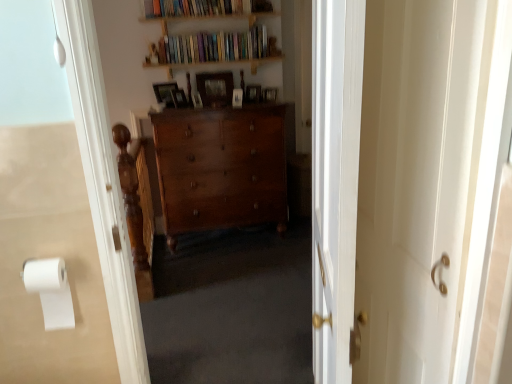
The image size is (512, 384). Identify the location of wooden picture frame at center, which ranks as the 2th picture frame in right-to-left order. (253, 93).

Where is `wooden picture frame at center, arranged as the 4th picture frame when viewed from the right`? The height and width of the screenshot is (384, 512). wooden picture frame at center, arranged as the 4th picture frame when viewed from the right is located at coordinates (215, 88).

This screenshot has height=384, width=512. I want to click on wooden picture frame at center, the sixth picture frame in the right-to-left sequence, so click(x=165, y=93).

Find the location of `wooden picture frame at center, acting as the fifth picture frame starting from the right`. wooden picture frame at center, acting as the fifth picture frame starting from the right is located at coordinates (179, 98).

Find the location of a particular element. Image resolution: width=512 pixels, height=384 pixels. hardcover books at upper center, the second book when ordered from top to bottom is located at coordinates (215, 46).

What do you see at coordinates (425, 182) in the screenshot? I see `white glossy screen door at center` at bounding box center [425, 182].

What are the coordinates of `wooden picture frame at center, which is the 3th picture frame in right-to-left order` in the screenshot? It's located at (237, 98).

From the image's perspective, who appears lower, wooden picture frame at center, placed as the fifth picture frame when sorted from left to right, or wooden picture frame at center, which is the sixth picture frame in left-to-right order?

wooden picture frame at center, which is the sixth picture frame in left-to-right order, from the image's perspective.

Is wooden picture frame at center, which ranks as the 2th picture frame in right-to-left order, shorter than wooden picture frame at center, which is the sixth picture frame in left-to-right order?

No.

Considering the sizes of wooden picture frame at center, which ranks as the 2th picture frame in right-to-left order, and wooden picture frame at center, which is the sixth picture frame in left-to-right order, in the image, is wooden picture frame at center, which ranks as the 2th picture frame in right-to-left order, wider or thinner than wooden picture frame at center, which is the sixth picture frame in left-to-right order,?

Considering their sizes, wooden picture frame at center, which ranks as the 2th picture frame in right-to-left order, looks broader than wooden picture frame at center, which is the sixth picture frame in left-to-right order.

Considering the points (247, 88) and (263, 99), which point is behind, point (247, 88) or point (263, 99)?

The point (263, 99) is farther.

The image size is (512, 384). I want to click on cabinetry below the wooden picture frame at center, placed as the fifth picture frame when sorted from left to right (from a real-world perspective), so click(221, 168).

In the image, is wooden picture frame at center, which ranks as the 2th picture frame in right-to-left order, positioned in front of or behind polished wood dresser at center?

wooden picture frame at center, which ranks as the 2th picture frame in right-to-left order, is behind polished wood dresser at center.

How much distance is there between wooden picture frame at center, placed as the fifth picture frame when sorted from left to right, and polished wood dresser at center?

wooden picture frame at center, placed as the fifth picture frame when sorted from left to right, is 29.98 inches from polished wood dresser at center.

Is polished wood dresser at center at the back of wooden picture frame at center, which ranks as the 2th picture frame in right-to-left order?

No, wooden picture frame at center, which ranks as the 2th picture frame in right-to-left order, is not facing away from polished wood dresser at center.

Based on their sizes in the image, would you say wooden picture frame at center, which ranks as the 2th picture frame in right-to-left order, is bigger or smaller than hardcover books at upper center, the second book when ordered from top to bottom?

Considering their sizes, wooden picture frame at center, which ranks as the 2th picture frame in right-to-left order, takes up less space than hardcover books at upper center, the second book when ordered from top to bottom.

Is point (252, 95) closer or farther from the camera than point (190, 54)?

Point (252, 95) is positioned farther from the camera compared to point (190, 54).

Is wooden picture frame at center, placed as the fifth picture frame when sorted from left to right, oriented towards hardcover books at upper center, the second book when ordered from top to bottom?

No, wooden picture frame at center, placed as the fifth picture frame when sorted from left to right, is not oriented towards hardcover books at upper center, the second book when ordered from top to bottom.

Who is more distant, wooden picture frame at center, which ranks as the 2th picture frame in right-to-left order, or hardcover books at upper center, placed as the first book when sorted from bottom to top?

wooden picture frame at center, which ranks as the 2th picture frame in right-to-left order, is further away from the camera.

Is wooden bookshelf at upper center, which ranks as the 1th book in top-to-bottom order, aimed at wooden picture frame at center, the 1th picture frame in the left-to-right sequence?

No, wooden bookshelf at upper center, which ranks as the 1th book in top-to-bottom order, is not oriented towards wooden picture frame at center, the 1th picture frame in the left-to-right sequence.

From a real-world perspective, which is physically below, wooden bookshelf at upper center, which appears as the 2th book when ordered from the bottom, or wooden picture frame at center, the sixth picture frame in the right-to-left sequence?

From a 3D spatial view, wooden picture frame at center, the sixth picture frame in the right-to-left sequence, is below.

Is there a large distance between wooden bookshelf at upper center, which ranks as the 1th book in top-to-bottom order, and wooden picture frame at center, the 1th picture frame in the left-to-right sequence?

wooden bookshelf at upper center, which ranks as the 1th book in top-to-bottom order, is near wooden picture frame at center, the 1th picture frame in the left-to-right sequence, not far away.

From the image's perspective, is wooden picture frame at center, the sixth picture frame in the right-to-left sequence, under polished wood dresser at center?

Incorrect, from the image's perspective, wooden picture frame at center, the sixth picture frame in the right-to-left sequence, is higher than polished wood dresser at center.

Looking at this image, from a real-world perspective, between wooden picture frame at center, the sixth picture frame in the right-to-left sequence, and polished wood dresser at center, who is vertically lower?

polished wood dresser at center.

Is wooden picture frame at center, the sixth picture frame in the right-to-left sequence, thinner than polished wood dresser at center?

Yes.

Is wooden picture frame at center, the sixth picture frame in the right-to-left sequence, looking in the opposite direction of white glossy screen door at center?

No, wooden picture frame at center, the sixth picture frame in the right-to-left sequence, is not facing the opposite direction of white glossy screen door at center.

Can you confirm if wooden picture frame at center, the sixth picture frame in the right-to-left sequence, is smaller than white glossy screen door at center?

Indeed, wooden picture frame at center, the sixth picture frame in the right-to-left sequence, has a smaller size compared to white glossy screen door at center.

This screenshot has height=384, width=512. I want to click on the 6th picture frame to the left of the white glossy screen door at center, starting your count from the anchor, so click(x=165, y=93).

Between point (163, 97) and point (453, 141), which one is positioned in front?

The point (453, 141) is more forward.

Is there a large distance between wooden picture frame at center, which is the 3th picture frame in right-to-left order, and wooden picture frame at center, the sixth picture frame in the right-to-left sequence?

Actually, wooden picture frame at center, which is the 3th picture frame in right-to-left order, and wooden picture frame at center, the sixth picture frame in the right-to-left sequence, are a little close together.

Is point (242, 99) positioned after point (155, 83)?

Yes, it is behind point (155, 83).

How many degrees apart are the facing directions of wooden picture frame at center, marked as the 4th picture frame in a left-to-right arrangement, and wooden picture frame at center, the sixth picture frame in the right-to-left sequence?

78.5 degrees separate the facing orientations of wooden picture frame at center, marked as the 4th picture frame in a left-to-right arrangement, and wooden picture frame at center, the sixth picture frame in the right-to-left sequence.

Looking at the image, does wooden picture frame at center, marked as the 4th picture frame in a left-to-right arrangement, seem bigger or smaller compared to wooden picture frame at center, the 1th picture frame in the left-to-right sequence?

Considering their sizes, wooden picture frame at center, marked as the 4th picture frame in a left-to-right arrangement, takes up less space than wooden picture frame at center, the 1th picture frame in the left-to-right sequence.

Find the location of a particular element. This screenshot has width=512, height=384. the 2nd picture frame below the wooden picture frame at center, which ranks as the 2th picture frame in right-to-left order (from the image's perspective) is located at coordinates (270, 94).

Identify the location of cabinetry on the left of wooden picture frame at center, which ranks as the 2th picture frame in right-to-left order. This screenshot has height=384, width=512. coord(221,168).

Based on their spatial positions, is wooden picture frame at center, the sixth picture frame in the right-to-left sequence, or wooden bookshelf at upper center, which appears as the 2th book when ordered from the bottom, closer to white matte toilet paper at left?

wooden picture frame at center, the sixth picture frame in the right-to-left sequence, is closer to white matte toilet paper at left.

Based on their spatial positions, is white matte toilet paper at left or wooden picture frame at center, the first picture frame viewed from the right, further from wooden picture frame at center, marked as the 4th picture frame in a left-to-right arrangement?

white matte toilet paper at left is further to wooden picture frame at center, marked as the 4th picture frame in a left-to-right arrangement.

Estimate the real-world distances between objects in this image. Which object is closer to wooden picture frame at center, which is the sixth picture frame in left-to-right order, polished wood dresser at center or white glossy screen door at center?

Based on the image, polished wood dresser at center appears to be nearer to wooden picture frame at center, which is the sixth picture frame in left-to-right order.

Based on the photo, estimate the real-world distances between objects in this image. Which object is further from wooden picture frame at center, the 3th picture frame in the left-to-right sequence, wooden picture frame at center, marked as the 4th picture frame in a left-to-right arrangement, or wooden bookshelf at upper center, which ranks as the 1th book in top-to-bottom order?

wooden bookshelf at upper center, which ranks as the 1th book in top-to-bottom order, is further to wooden picture frame at center, the 3th picture frame in the left-to-right sequence.

Looking at this image, based on their spatial positions, is white matte toilet paper at left or wooden picture frame at center, the sixth picture frame in the right-to-left sequence, further from polished wood dresser at center?

The object further to polished wood dresser at center is white matte toilet paper at left.

Which object lies nearer to the anchor point wooden bookshelf at upper center, which appears as the 2th book when ordered from the bottom, wooden picture frame at center, acting as the fifth picture frame starting from the right, or wooden picture frame at center, the 3th picture frame in the left-to-right sequence?

wooden picture frame at center, the 3th picture frame in the left-to-right sequence, lies closer to wooden bookshelf at upper center, which appears as the 2th book when ordered from the bottom, than the other object.

Looking at the image, which one is located further to wooden picture frame at center, which is the 3th picture frame in right-to-left order, wooden picture frame at center, the first picture frame viewed from the right, or wooden bookshelf at upper center, which appears as the 2th book when ordered from the bottom?

wooden bookshelf at upper center, which appears as the 2th book when ordered from the bottom, lies further to wooden picture frame at center, which is the 3th picture frame in right-to-left order, than the other object.

Considering their positions, is wooden picture frame at center, acting as the fifth picture frame starting from the right, positioned closer to wooden bookshelf at upper center, which appears as the 2th book when ordered from the bottom, than white matte toilet paper at left?

wooden picture frame at center, acting as the fifth picture frame starting from the right.

Find the location of a particular element. This screenshot has height=384, width=512. book between wooden bookshelf at upper center, which ranks as the 1th book in top-to-bottom order, and wooden picture frame at center, the sixth picture frame in the right-to-left sequence, in the vertical direction is located at coordinates (215, 46).

You are a GUI agent. You are given a task and a screenshot of the screen. Output one action in this format:
    pyautogui.click(x=<x>, y=<y>)
    Task: Click on the cabinetry between white matte toilet paper at left and wooden picture frame at center, the 3th picture frame in the left-to-right sequence, from front to back
    
    Given the screenshot: What is the action you would take?
    pyautogui.click(x=221, y=168)

The image size is (512, 384). I want to click on picture frame between wooden picture frame at center, arranged as the 4th picture frame when viewed from the right, and wooden picture frame at center, placed as the fifth picture frame when sorted from left to right, in the horizontal direction, so click(237, 98).

You are a GUI agent. You are given a task and a screenshot of the screen. Output one action in this format:
    pyautogui.click(x=<x>, y=<y>)
    Task: Click on the cabinetry between white glossy screen door at center and wooden picture frame at center, which is the 3th picture frame in right-to-left order, along the z-axis
    This screenshot has width=512, height=384.
    Given the screenshot: What is the action you would take?
    pyautogui.click(x=221, y=168)